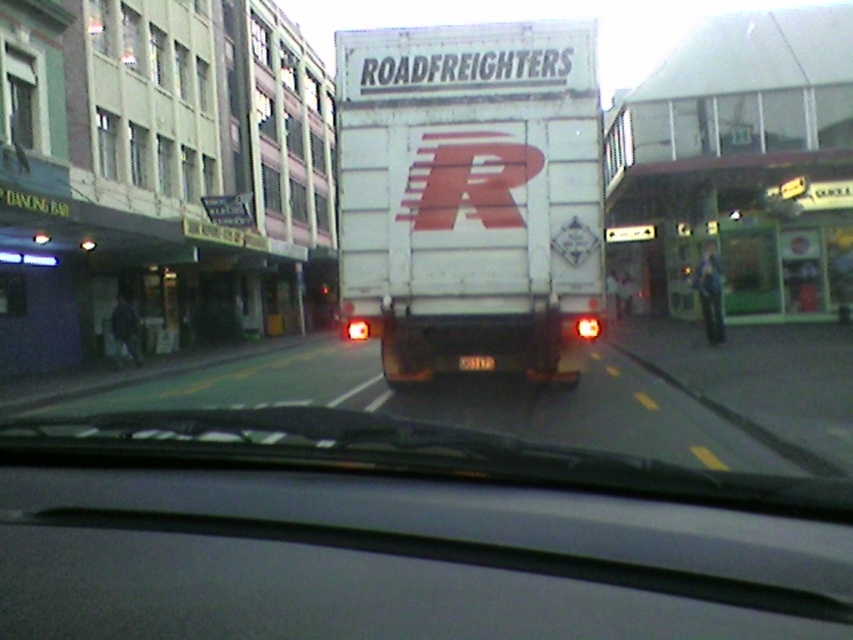
You are driving a car and need to know if there is enough space between the matte black dashboard at center and the white matte trailer truck at center to safely pass another vehicle. Can you determine if the space between them is sufficient for a car that is 4 meters wide?

The space between the matte black dashboard at center and the white matte trailer truck at center is 7.76 meters. Since the car is only 4 meters wide, there is enough space to safely pass.

You are a delivery driver who needs to attach a new license plate to your white matte trailer truck at center. The current black plastic license plate at rear is too far away. What is the minimum distance in feet you need to move the license plate closer to the truck?

Answer: The current distance between the white matte trailer truck at center and the black plastic license plate at rear is 3.38 feet. To make the license plate closer, you need to reduce this distance. However, the question states that the current plate is too far away, so the minimum distance required would be less than 3.38 feet. But since we don not have the desired distance specified, we cannot provide an exact number. Please specify the required distance for the license plate.